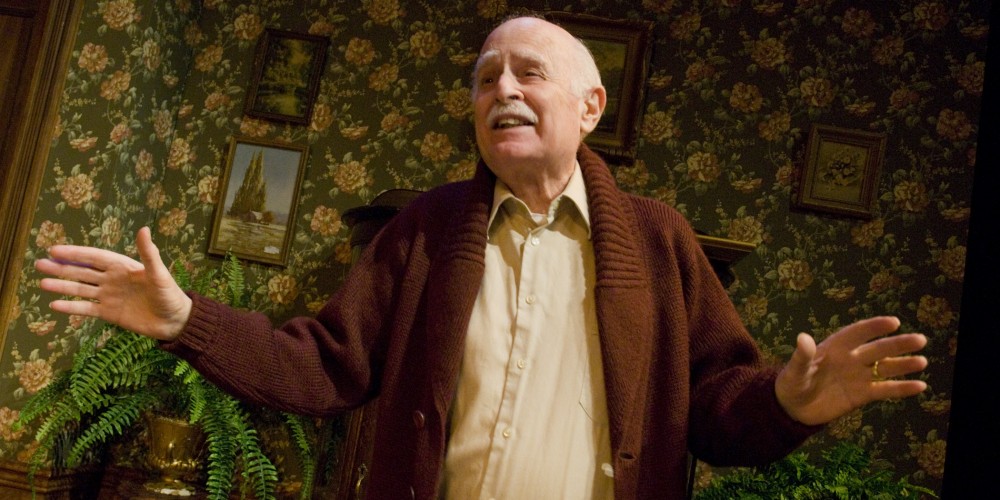
The width and height of the screenshot is (1000, 500). I want to click on wall, so click(695, 40).